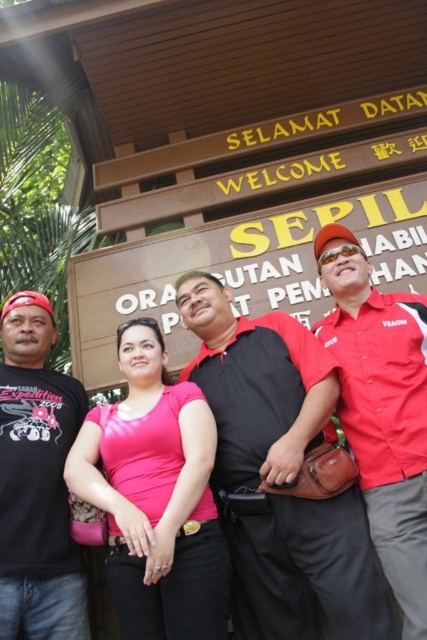
You are standing in front of the wooden signboard and notice the black smooth shirt at center and the wooden sign at center. Which object is nearer to you?

The black smooth shirt at center is closer to the viewer than the wooden sign at center.

You are a photographer adjusting the camera settings to ensure both the pink matte shirt at center and the wooden sign at center are in focus. Which object should you focus on first to ensure the other is also in focus, considering their relative heights?

The pink matte shirt at center is taller than the wooden sign at center. Therefore, focusing on the pink matte shirt at center first will ensure the wooden sign at center is also in focus since it is shorter.

You are trying to identify clothing items in the photo. Which shirt, the black smooth shirt at center or the pink matte shirt at center, is visible on top?

The black smooth shirt at center is positioned over the pink matte shirt at center, so the black smooth shirt at center is visible on top.